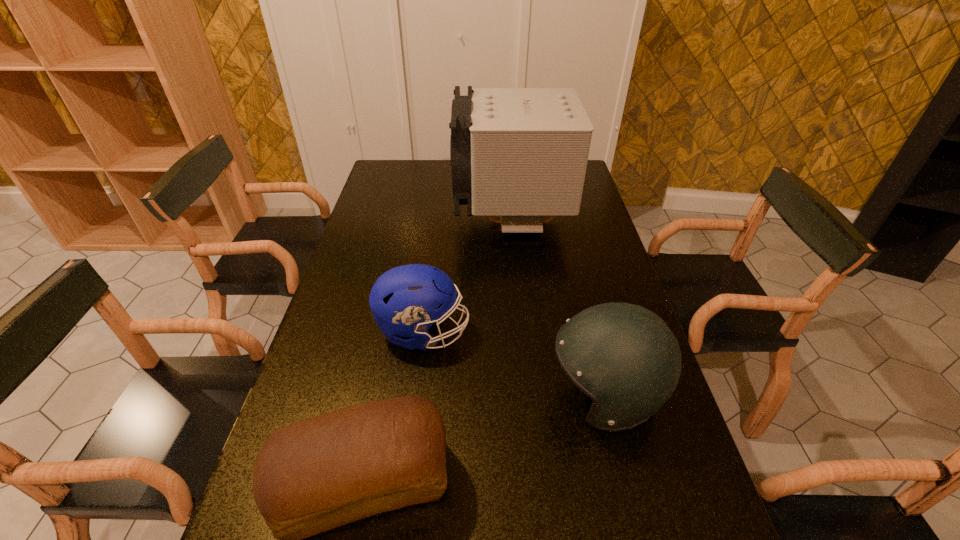
Identify the location of object present at the left edge. (407, 300).

The image size is (960, 540). Find the location of `fan that is at the right edge`. fan that is at the right edge is located at coordinates (521, 154).

The image size is (960, 540). Identify the location of football helmet situated at the right edge. (624, 357).

In the image, there is a desktop. Identify the location of vacant region at the left edge. (354, 357).

In the image, there is a desktop. Where is `vacant space at the right edge`? vacant space at the right edge is located at coordinates (566, 241).

You are a GUI agent. You are given a task and a screenshot of the screen. Output one action in this format:
    pyautogui.click(x=<x>, y=<y>)
    Task: Click on the vacant space in between the left football helmet and the third shortest object
    Image resolution: width=960 pixels, height=540 pixels.
    Given the screenshot: What is the action you would take?
    pyautogui.click(x=514, y=363)

Where is `free space between the fan and the shorter football helmet`? This screenshot has width=960, height=540. free space between the fan and the shorter football helmet is located at coordinates pos(468,276).

Where is `free space between the shorter football helmet and the third shortest object`? free space between the shorter football helmet and the third shortest object is located at coordinates (514, 363).

You are a GUI agent. You are given a task and a screenshot of the screen. Output one action in this format:
    pyautogui.click(x=<x>, y=<y>)
    Task: Click on the free spot between the third shortest object and the fan
    Image resolution: width=960 pixels, height=540 pixels.
    Given the screenshot: What is the action you would take?
    pyautogui.click(x=558, y=308)

Where is `the closest object to the taller football helmet`? The width and height of the screenshot is (960, 540). the closest object to the taller football helmet is located at coordinates (407, 300).